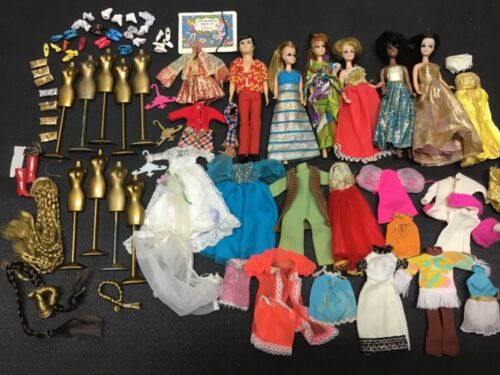
I want to click on dolls, so click(247, 69), click(286, 74), click(320, 69), click(351, 70), click(394, 65), click(433, 65).